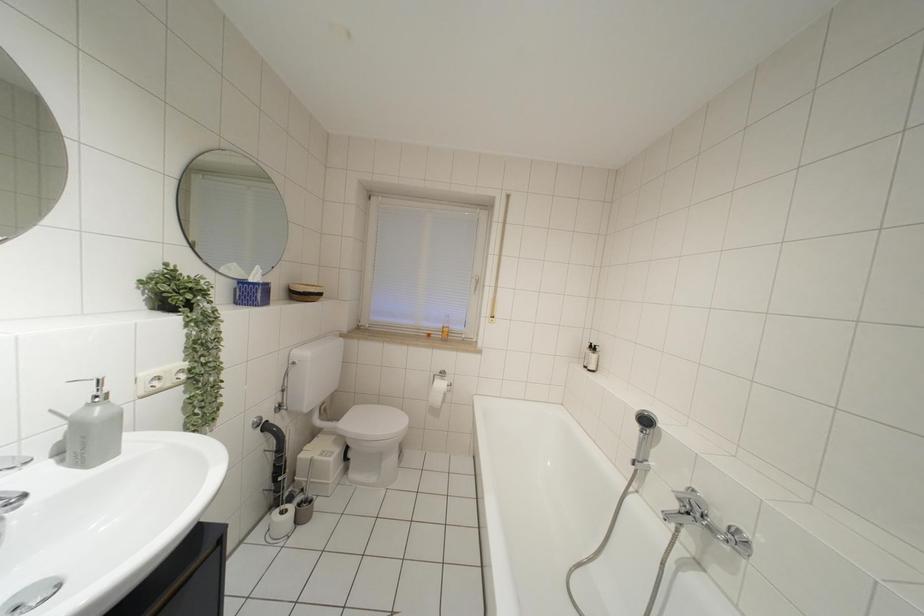
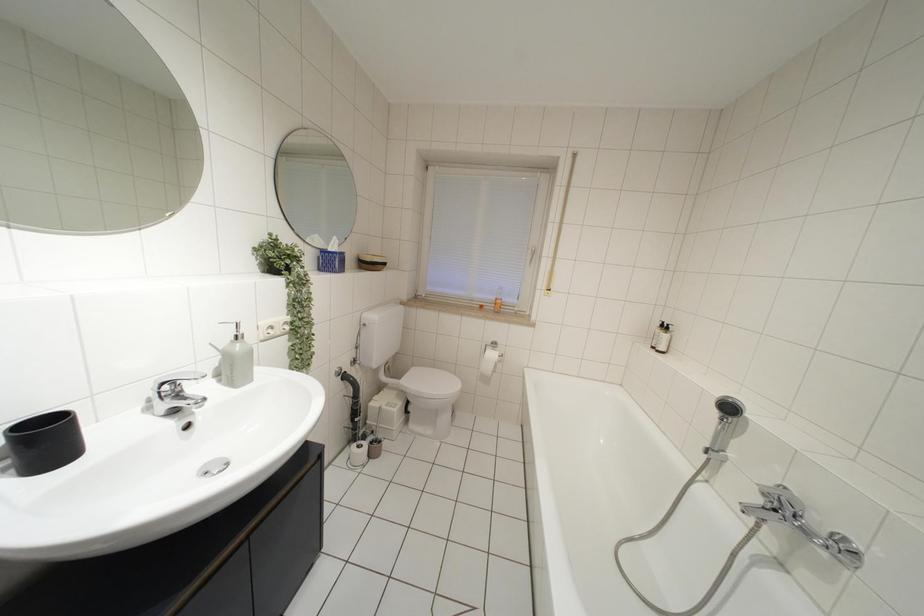
The images are taken continuously from a first-person perspective. In which direction are you moving?

The cameraman walked toward left, backward.